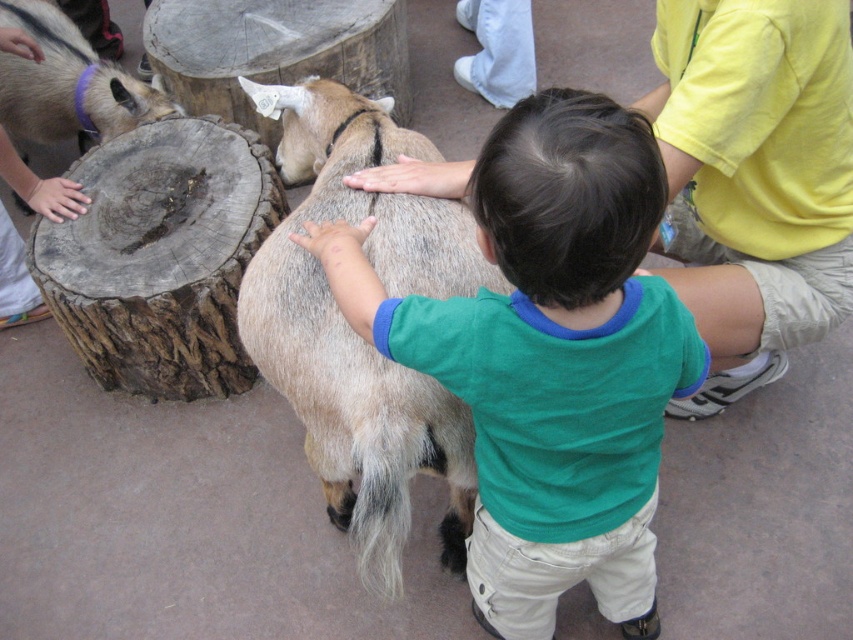
Does green cotton shirt at center have a larger size compared to light brown fur at center?

No, green cotton shirt at center is not bigger than light brown fur at center.

Which is in front, point (631, 513) or point (326, 88)?

Positioned in front is point (631, 513).

Does point (541, 552) lie behind point (426, 147)?

No, (541, 552) is in front of (426, 147).

At what (x,y) coordinates should I click in order to perform the action: click on green cotton shirt at center. Please return your answer as a coordinate pair (x, y). Image resolution: width=853 pixels, height=640 pixels. Looking at the image, I should click on (550, 358).

Which is behind, point (355, 323) or point (73, 131)?

Positioned behind is point (73, 131).

Does green cotton shirt at center appear under purple leather collar at upper left?

Indeed, green cotton shirt at center is positioned under purple leather collar at upper left.

Locate an element on the screen. The height and width of the screenshot is (640, 853). green cotton shirt at center is located at coordinates (550, 358).

Between point (264, 291) and point (32, 28), which one is positioned in front?

Point (264, 291) is in front.

In the scene shown: Is light brown fur at center in front of purple leather collar at upper left?

Yes, light brown fur at center is closer to the viewer.

Describe the element at coordinates (352, 330) in the screenshot. I see `light brown fur at center` at that location.

Where is `light brown fur at center`? This screenshot has width=853, height=640. light brown fur at center is located at coordinates (352, 330).